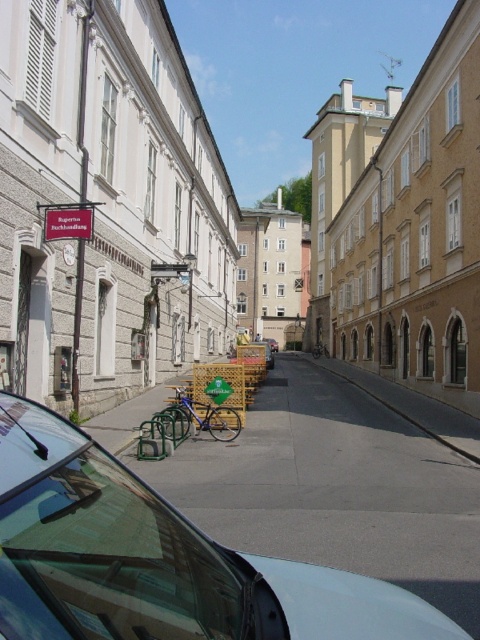
Question: Which point is farther to the camera?

Choices:
 (A) metallic silver car at center
 (B) brown textured building at right

Answer: (B)

Question: Does metallic silver car at center have a greater width compared to brown textured building at right?

Choices:
 (A) yes
 (B) no

Answer: (B)

Question: Is metallic silver car at center thinner than brown textured building at right?

Choices:
 (A) yes
 (B) no

Answer: (A)

Question: Among these objects, which one is nearest to the camera?

Choices:
 (A) brown textured building at right
 (B) metallic silver car at center

Answer: (B)

Question: Is metallic silver car at center thinner than brown textured building at right?

Choices:
 (A) yes
 (B) no

Answer: (A)